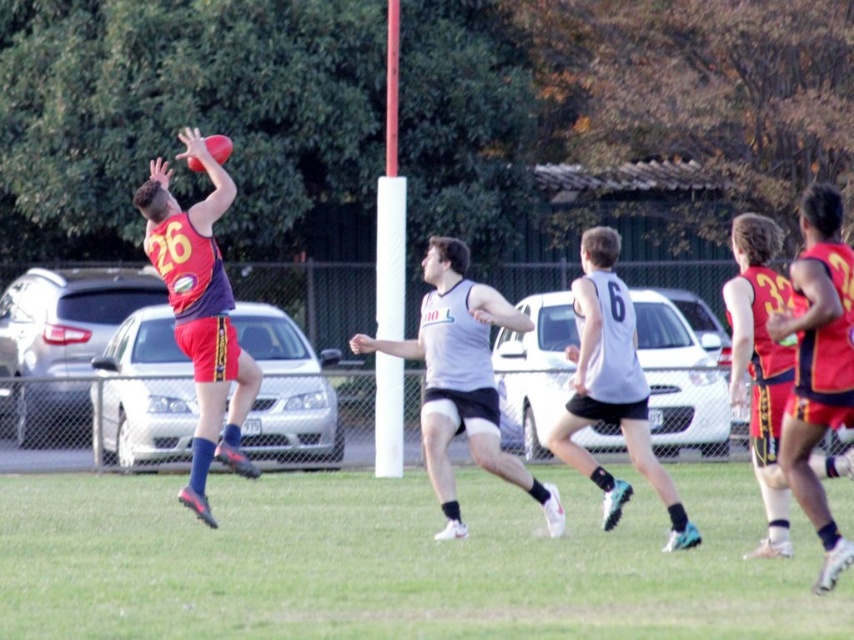
You are a sports analyst watching the AFL match. You observe the green grass at center and the gray matte jersey at center. Which object is closer to the camera?

The green grass at center is closer to the camera because it is in front of the gray matte jersey at center.

You are a sports analyst watching the game. You notice two players, the gray matte jersey at center and the matte red jersey at left. Which player has a height advantage?

The gray matte jersey at center is much taller than the matte red jersey at left, so the gray matte jersey at center has the height advantage.

You are a soccer player trying to decide where to place your foot to kick the ball. You see the green grass at center and the gray matte jersey at center. Which surface should you choose to ensure a stable footing?

The green grass at center is wider than the gray matte jersey at center, so it provides a larger and more stable surface for your foot.